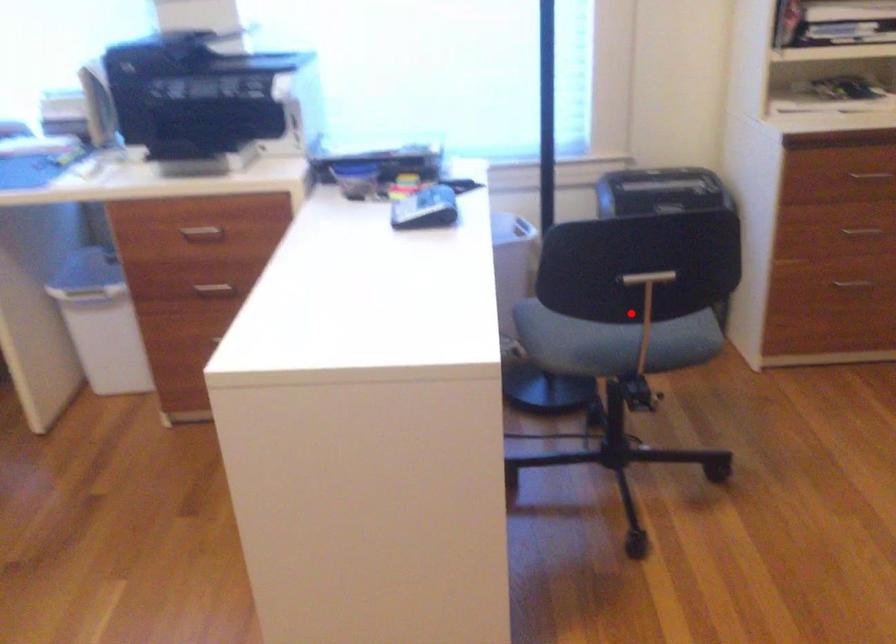
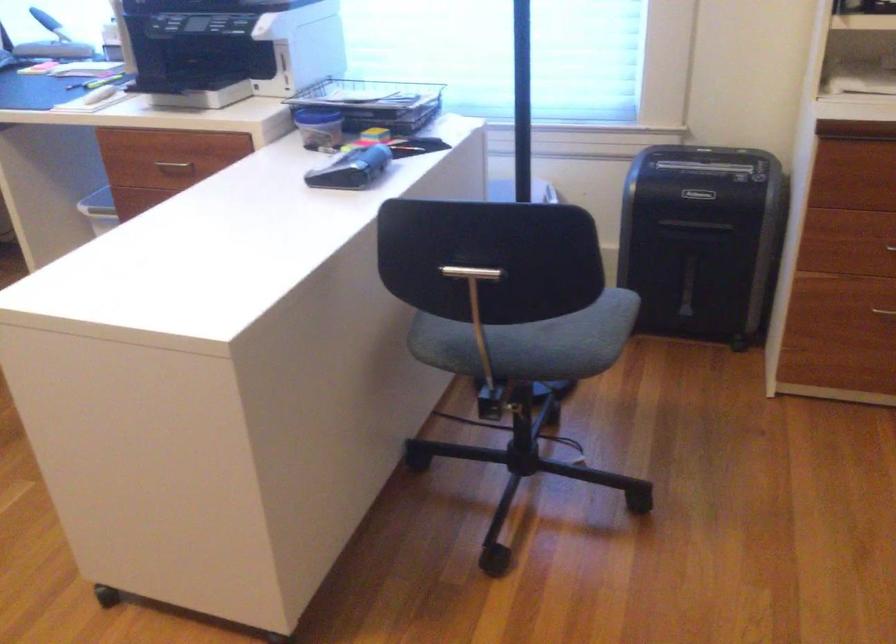
Question: I am providing you with two images of the same scene from different viewpoints. Given a red point in image1, look at the same physical point in image2. Is it:

Choices:
 (A) Closer to the viewpoint
 (B) Farther from the viewpoint

Answer: (A)